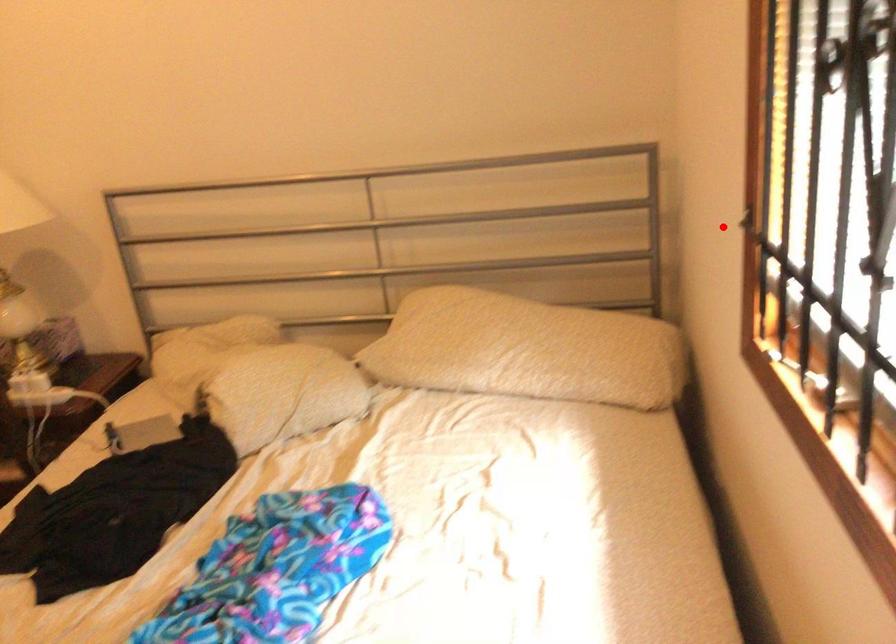
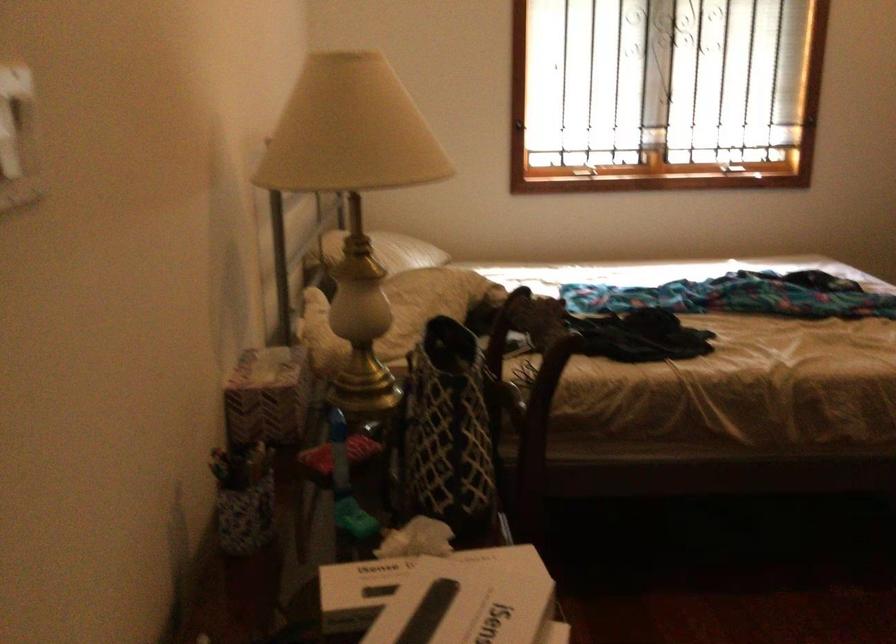
Question: I am providing you with two images of the same scene from different viewpoints. Image1 has a red point marked. In image2, the corresponding 3D location appears at what relative position? Reply with the corresponding letter.

Choices:
 (A) Closer
 (B) Farther

Answer: (B)